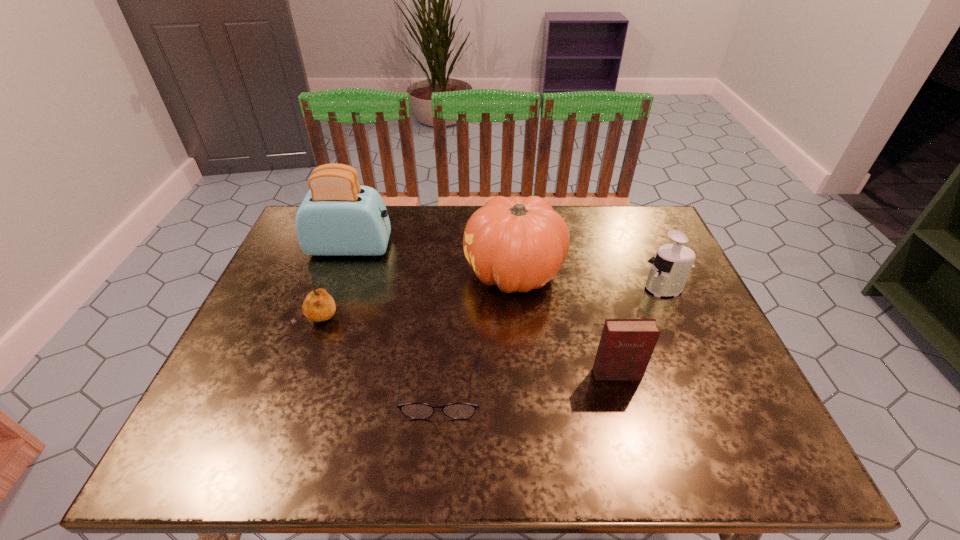
The image size is (960, 540). What are the coordinates of `free point at the far edge` in the screenshot? It's located at (588, 206).

Where is `free space at the near edge`? This screenshot has height=540, width=960. free space at the near edge is located at coordinates (531, 434).

Identify the location of vacant space at the far right corner. (622, 233).

Identify the location of vacant region at the near right corner of the desktop. Image resolution: width=960 pixels, height=540 pixels. (735, 431).

Where is `free space between the spectacles and the diary`? This screenshot has height=540, width=960. free space between the spectacles and the diary is located at coordinates (529, 380).

Identify the location of vacant space that's between the shortest object and the pear. Image resolution: width=960 pixels, height=540 pixels. (380, 353).

You are a GUI agent. You are given a task and a screenshot of the screen. Output one action in this format:
    pyautogui.click(x=<x>, y=<y>)
    Task: Click on the free space between the fifth shortest object and the shortest object
    The height and width of the screenshot is (540, 960).
    Given the screenshot: What is the action you would take?
    pyautogui.click(x=478, y=330)

You are a GUI agent. You are given a task and a screenshot of the screen. Output one action in this format:
    pyautogui.click(x=<x>, y=<y>)
    Task: Click on the vacant space that's between the spectacles and the juicer
    The height and width of the screenshot is (540, 960).
    Given the screenshot: What is the action you would take?
    pyautogui.click(x=553, y=338)

This screenshot has height=540, width=960. I want to click on free point between the fifth object from left to right and the pear, so click(468, 347).

The image size is (960, 540). In order to click on empty space between the shortest object and the fifth tallest object in this screenshot , I will do `click(380, 353)`.